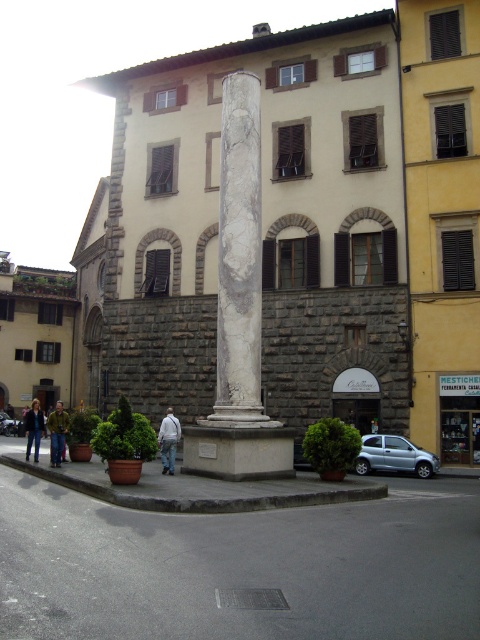
You are a delivery person trying to place a white cotton jacket at center and a dark blue jacket at lower left on a rack. The rack has limited space. Which jacket should you place first to ensure both fit?

The white cotton jacket at center is positioned over the dark blue jacket at lower left, so you should place the dark blue jacket at lower left first to make space for the white cotton jacket at center on top.

You are a tourist in this historical area and see both the white cotton jacket at center and the dark blue jacket at lower left. Which jacket is located to the right of the other?

The white cotton jacket at center is positioned on the right side of dark blue jacket at lower left.